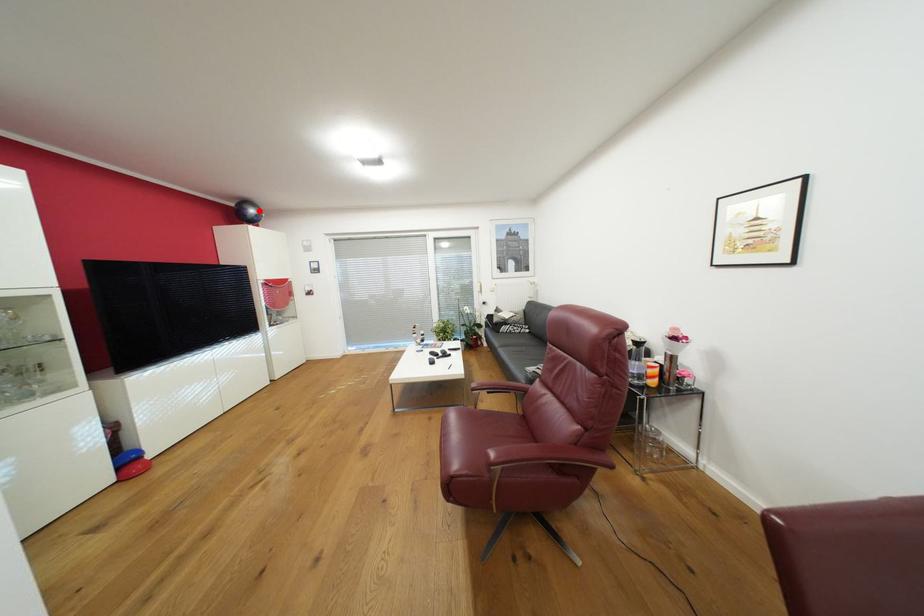
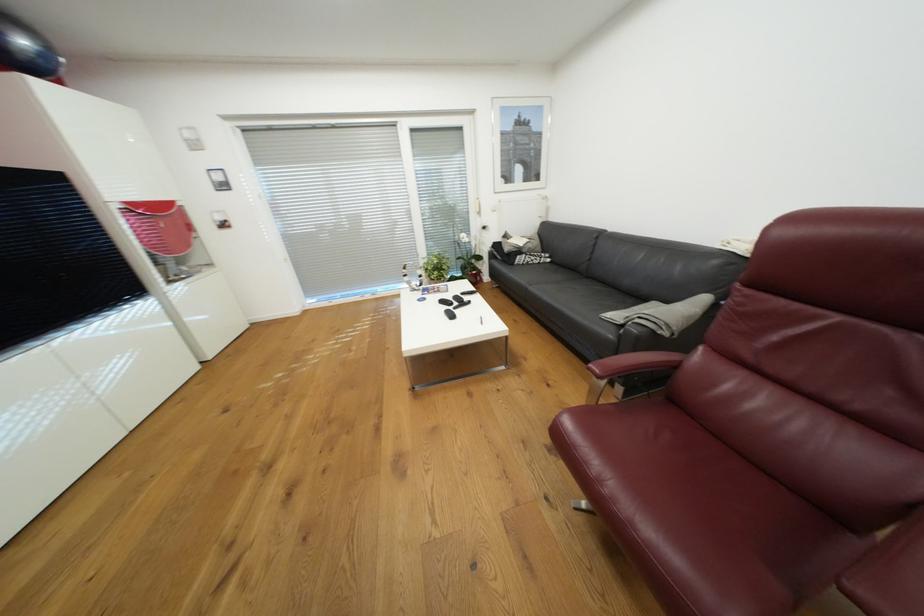
Question: I am providing you with two images of the same scene from different viewpoints. A red point is marked on the first image. At the location where the point appears in image 1, is it still visible in image 2?

Choices:
 (A) Yes
 (B) No

Answer: (A)